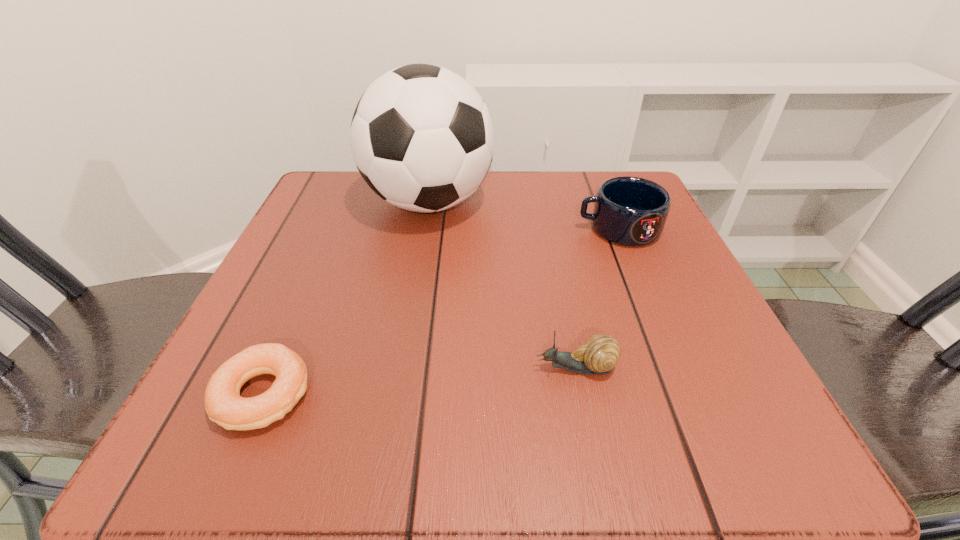
At what (x,y) coordinates should I click in order to perform the action: click on the tallest object. Please return your answer as a coordinate pair (x, y). Looking at the image, I should click on (422, 138).

Locate an element on the screen. mug is located at coordinates (631, 211).

Identify the location of the third shortest object. point(631,211).

Find the location of `escargot`. escargot is located at coordinates (599, 355).

Identify the location of the second object from right to left. This screenshot has height=540, width=960. (599, 355).

The image size is (960, 540). What are the coordinates of `bagel` in the screenshot? It's located at (224, 405).

At what (x,y) coordinates should I click in order to perform the action: click on blank space located on the front of the tallest object. Please return your answer as a coordinate pair (x, y). This screenshot has height=540, width=960. Looking at the image, I should click on (420, 257).

Locate an element on the screen. free region located with the handle on the side of the rightmost object is located at coordinates (532, 228).

Locate an element on the screen. This screenshot has height=540, width=960. free spot located with the handle on the side of the rightmost object is located at coordinates (507, 228).

The height and width of the screenshot is (540, 960). Identify the location of vacant space located with the handle on the side of the rightmost object. (385, 228).